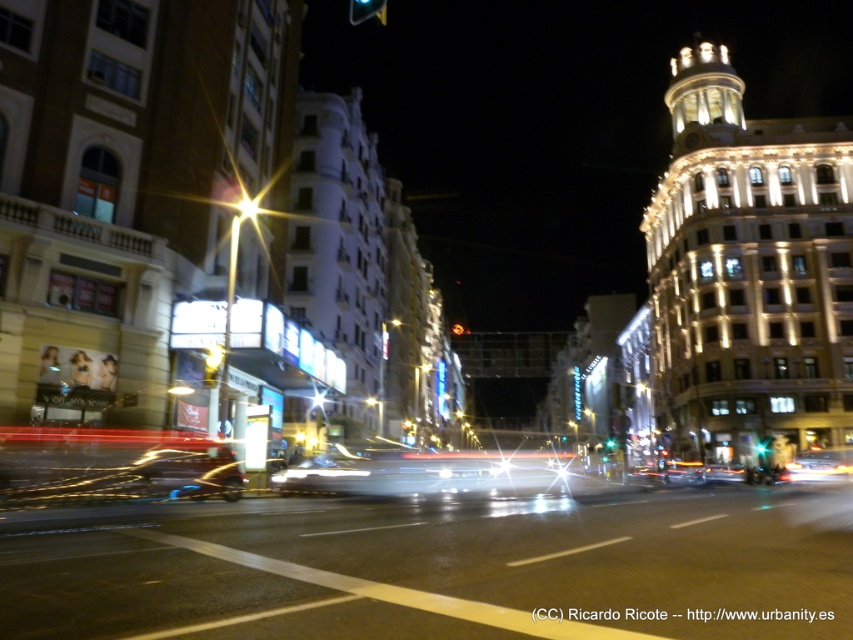
Question: Where is metallic silver car at lower left located in relation to bright metallic streetlight at upper center in the image?

Choices:
 (A) right
 (B) left

Answer: (B)

Question: Is bright metallic streetlight at upper center below green glass traffic light at center?

Choices:
 (A) no
 (B) yes

Answer: (A)

Question: Which point is farther from the camera taking this photo?

Choices:
 (A) (612, 444)
 (B) (106, 465)

Answer: (A)

Question: Which of the following is the farthest from the observer?

Choices:
 (A) (370, 3)
 (B) (91, 481)
 (C) (238, 198)
 (D) (608, 436)

Answer: (D)

Question: Does metallic silver car at lower left have a lesser width compared to amber glass traffic light at upper center?

Choices:
 (A) no
 (B) yes

Answer: (B)

Question: Which point appears closest to the camera in this image?

Choices:
 (A) (363, 3)
 (B) (605, 448)
 (C) (245, 209)
 (D) (44, 467)

Answer: (D)